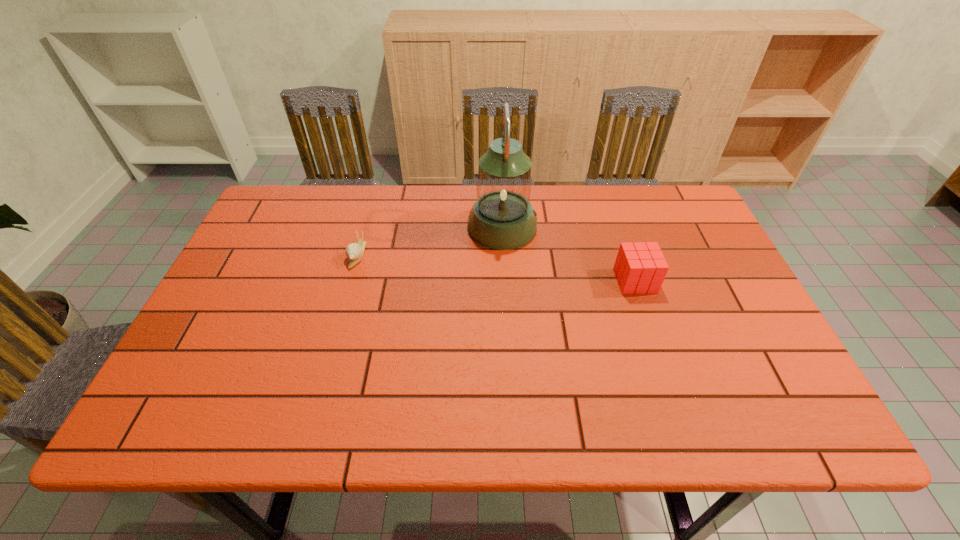
The height and width of the screenshot is (540, 960). In order to click on free area in between the cube and the escargot in this screenshot , I will do `click(496, 268)`.

Identify the location of free space that is in between the second shortest object and the leftmost object. click(496, 268).

Where is `empty space between the escargot and the tallest object`? The width and height of the screenshot is (960, 540). empty space between the escargot and the tallest object is located at coordinates (430, 241).

Find the location of a particular element. The height and width of the screenshot is (540, 960). free space between the escargot and the rightmost object is located at coordinates (496, 268).

This screenshot has width=960, height=540. Find the location of `vacant area between the second shortest object and the leftmost object`. vacant area between the second shortest object and the leftmost object is located at coordinates (496, 268).

Locate which object is the second closest to the lantern. Please provide its 2D coordinates. Your answer should be formatted as a tuple, i.e. [(x, y)], where the tuple contains the x and y coordinates of a point satisfying the conditions above.

[(354, 251)]

Image resolution: width=960 pixels, height=540 pixels. In order to click on object that stands as the second closest to the lantern in this screenshot , I will do `click(354, 251)`.

This screenshot has width=960, height=540. What are the coordinates of `vacant space that satisfies the following two spatial constraints: 1. on the shell of the escargot; 2. on the left side of the second shortest object` in the screenshot? It's located at (350, 281).

Find the location of a particular element. The height and width of the screenshot is (540, 960). free point that satisfies the following two spatial constraints: 1. on the shell of the escargot; 2. on the left side of the cube is located at coordinates (350, 281).

This screenshot has width=960, height=540. I want to click on vacant space that satisfies the following two spatial constraints: 1. on the shell of the cube; 2. on the left side of the escargot, so click(350, 281).